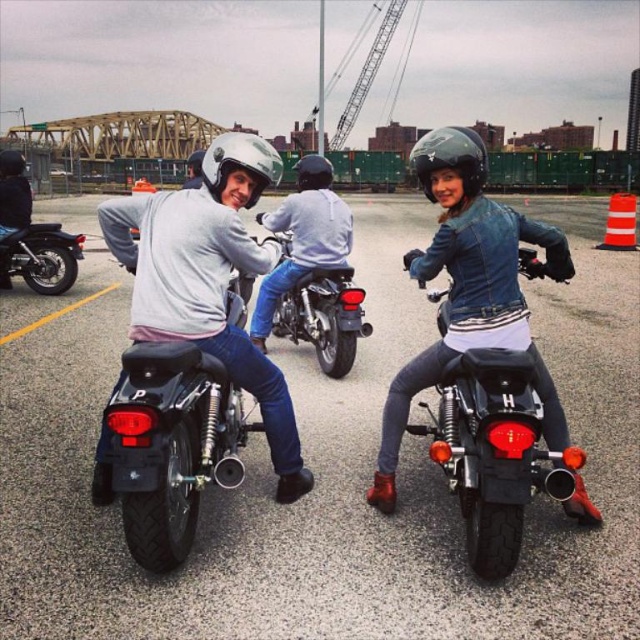
Question: Which point appears farthest from the camera in this image?

Choices:
 (A) (524, 403)
 (B) (324, 188)
 (C) (4, 241)
 (D) (19, 168)

Answer: (D)

Question: Where is shiny black motorcycle at center located in relation to shiny chrome motorcycle at center in the image?

Choices:
 (A) above
 (B) below

Answer: (B)

Question: Does matte white helmet at center have a greater width compared to matte white helmet at upper center?

Choices:
 (A) yes
 (B) no

Answer: (A)

Question: Which of these objects is positioned closest to the matte white helmet at center?

Choices:
 (A) shiny chrome motorcycle at center
 (B) matte gray sweatshirt at center
 (C) matte white helmet at upper center

Answer: (A)

Question: Which object appears closest to the camera in this image?

Choices:
 (A) glossy black helmet at center
 (B) matte white helmet at center
 (C) white matte helmet at center

Answer: (A)

Question: Is shiny black motorcycle at center wider than glossy black helmet at center?

Choices:
 (A) yes
 (B) no

Answer: (B)